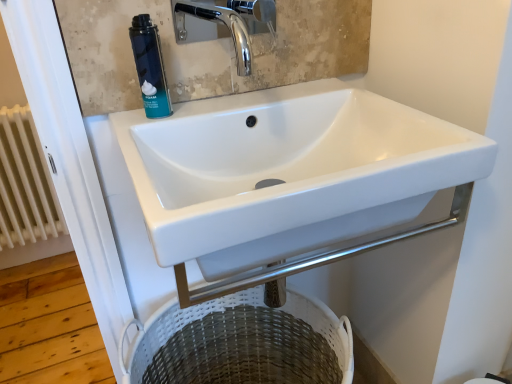
Question: Is white woven laundry basket at lower center not within white painted metal radiator at left?

Choices:
 (A) yes
 (B) no

Answer: (A)

Question: From a real-world perspective, does white woven laundry basket at lower center stand above white painted metal radiator at left?

Choices:
 (A) yes
 (B) no

Answer: (B)

Question: Is white woven laundry basket at lower center smaller than white painted metal radiator at left?

Choices:
 (A) no
 (B) yes

Answer: (A)

Question: Does white woven laundry basket at lower center appear on the left side of white painted metal radiator at left?

Choices:
 (A) no
 (B) yes

Answer: (A)

Question: Could you tell me if white woven laundry basket at lower center is turned towards white painted metal radiator at left?

Choices:
 (A) yes
 (B) no

Answer: (B)

Question: Is white painted metal radiator at left a part of white woven laundry basket at lower center?

Choices:
 (A) no
 (B) yes

Answer: (A)

Question: Is chrome metallic faucet at upper center outside of white painted metal radiator at left?

Choices:
 (A) no
 (B) yes

Answer: (B)

Question: From a real-world perspective, is chrome metallic faucet at upper center on white painted metal radiator at left?

Choices:
 (A) yes
 (B) no

Answer: (A)

Question: From the image's perspective, is chrome metallic faucet at upper center over white painted metal radiator at left?

Choices:
 (A) yes
 (B) no

Answer: (A)

Question: Is chrome metallic faucet at upper center positioned with its back to white painted metal radiator at left?

Choices:
 (A) no
 (B) yes

Answer: (A)

Question: Is chrome metallic faucet at upper center placed right next to white painted metal radiator at left?

Choices:
 (A) yes
 (B) no

Answer: (B)

Question: Is chrome metallic faucet at upper center shorter than white painted metal radiator at left?

Choices:
 (A) no
 (B) yes

Answer: (B)

Question: Would you say white painted metal radiator at left is outside chrome metallic faucet at upper center?

Choices:
 (A) no
 (B) yes

Answer: (B)